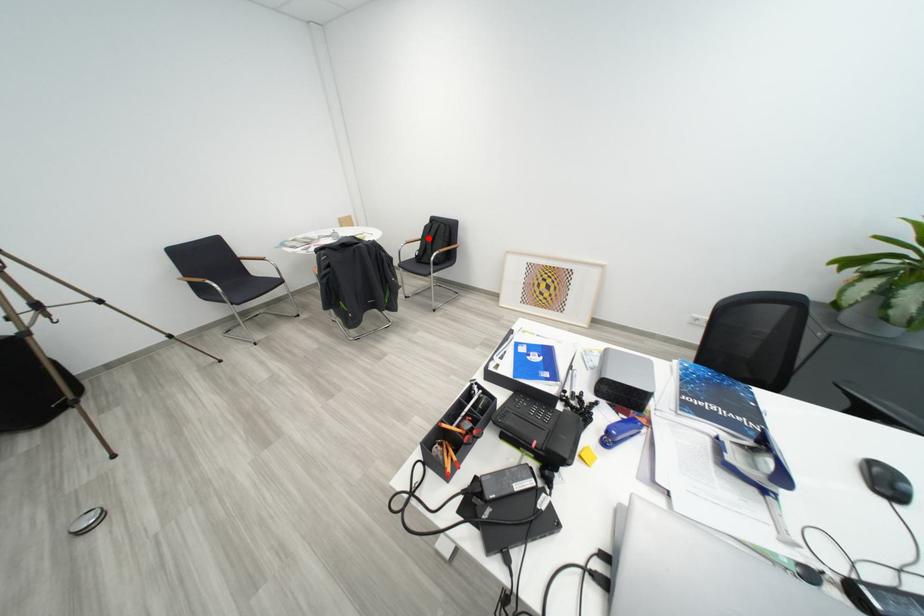
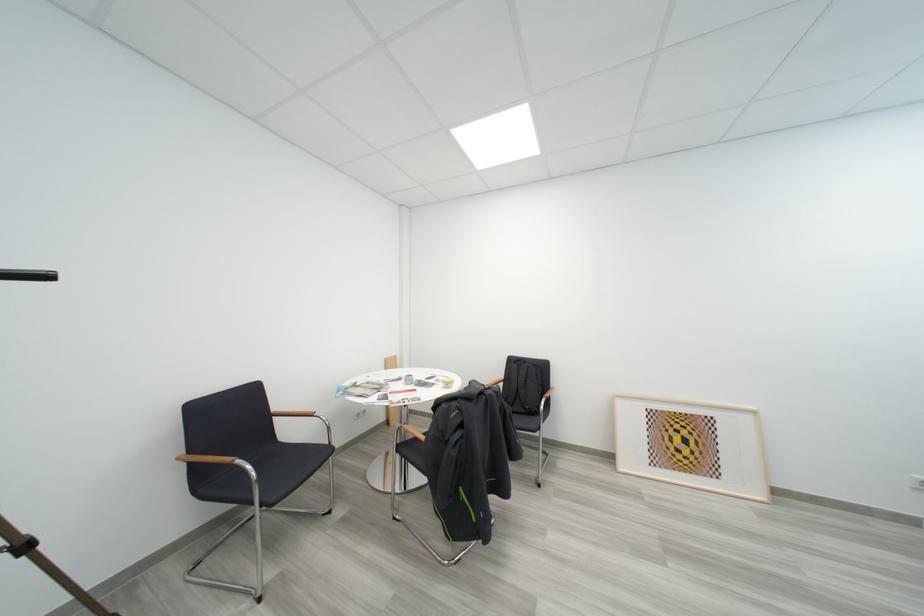
Question: I am providing you with two images of the same scene from different viewpoints. Given a red point in image1, look at the same physical point in image2. Is it:

Choices:
 (A) Closer to the viewpoint
 (B) Farther from the viewpoint

Answer: (B)